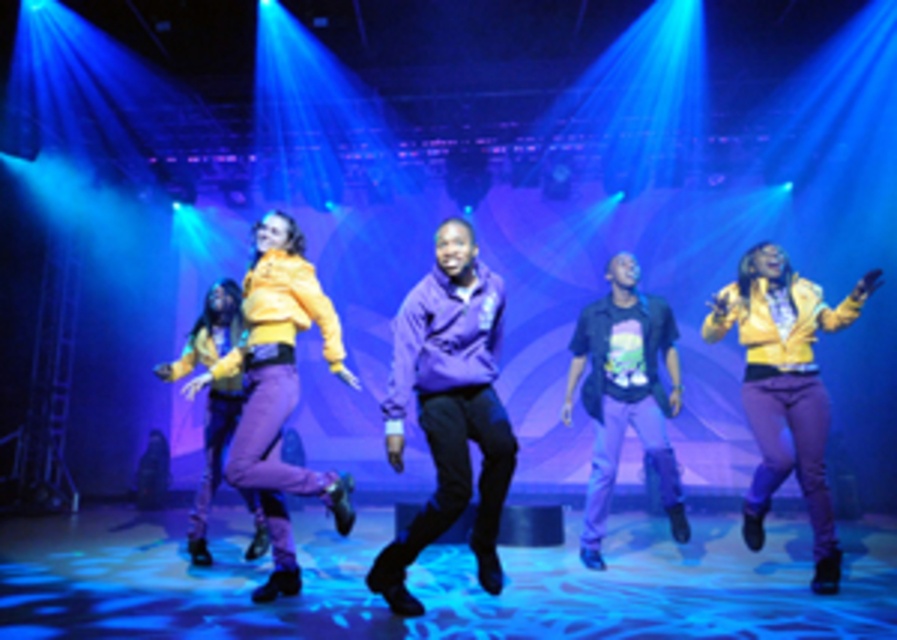
What do you see at coordinates (282, 390) in the screenshot? This screenshot has width=897, height=640. I see `matte yellow jacket at left` at bounding box center [282, 390].

Is matte yellow jacket at left closer to the viewer compared to matte yellow jacket at center?

Yes, it is in front of matte yellow jacket at center.

Locate an element on the screen. The width and height of the screenshot is (897, 640). matte yellow jacket at left is located at coordinates (282, 390).

Is yellow matte jacket at center positioned before black matte shirt at center?

Yes.

Who is more forward, (803,372) or (638,308)?

Answer: Point (803,372)

What are the coordinates of `yellow matte jacket at center` in the screenshot? It's located at tap(785, 387).

Is purple matte hoodie at center below matte yellow jacket at center?

Actually, purple matte hoodie at center is above matte yellow jacket at center.

Based on the photo, which is more to the left, purple matte hoodie at center or matte yellow jacket at center?

matte yellow jacket at center

What are the coordinates of `purple matte hoodie at center` in the screenshot? It's located at (448, 408).